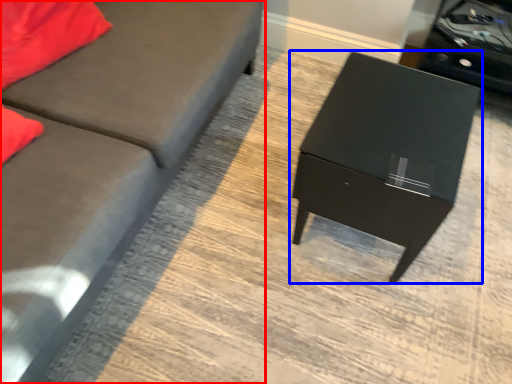
Question: Which of the following is the farthest to the observer, studio couch (highlighted by a red box) or table (highlighted by a blue box)?

Choices:
 (A) studio couch
 (B) table

Answer: (B)